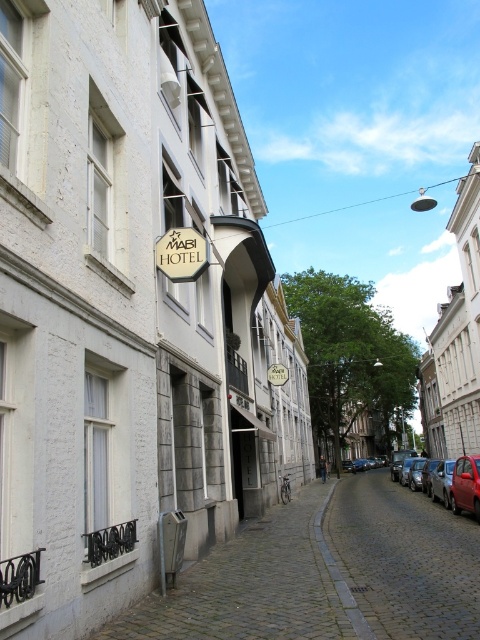
Question: Which point is farther to the camera?

Choices:
 (A) white plastic sign at upper center
 (B) shiny red car at right
 (C) red matte car at right
 (D) white stone building at upper right

Answer: (D)

Question: Which point is closer to the camera?

Choices:
 (A) white stone hotel at center
 (B) red matte car at right
 (C) white plastic sign at upper center

Answer: (A)

Question: Estimate the real-world distances between objects in this image. Which object is farther from the white stone hotel at center?

Choices:
 (A) shiny red car at right
 (B) white plastic sign at upper center
 (C) red matte car at right
 (D) matte gold hotel sign at center

Answer: (A)

Question: Does white stone hotel at center appear on the left side of shiny red car at right?

Choices:
 (A) yes
 (B) no

Answer: (A)

Question: Is white stone building at upper right positioned before red matte car at right?

Choices:
 (A) yes
 (B) no

Answer: (B)

Question: Does white stone hotel at center have a larger size compared to shiny red car at right?

Choices:
 (A) no
 (B) yes

Answer: (B)